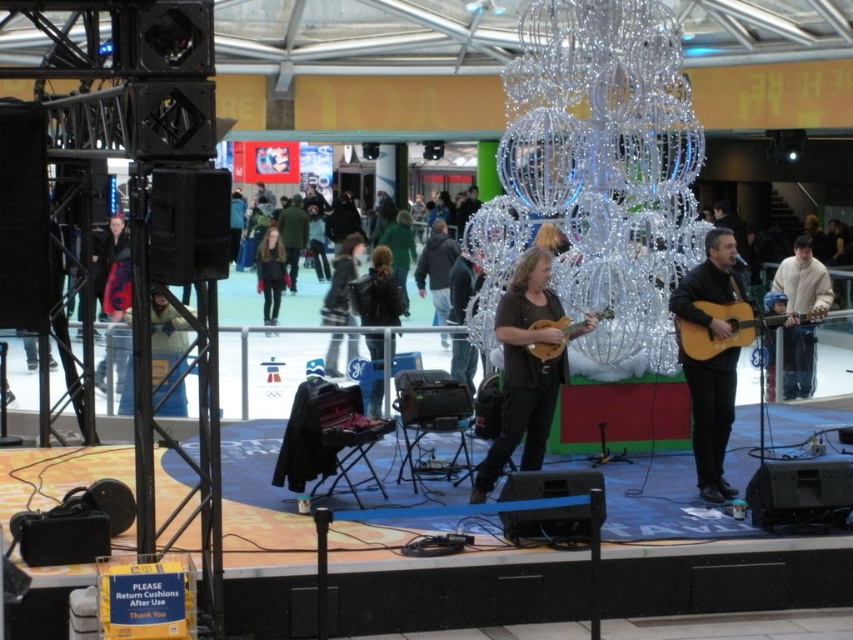
Consider the image. You are attending the event and want to take a photo of the performers. You notice the white woolen sweater at right and the black leather jacket at center. Which clothing item is shorter in height?

The white woolen sweater at right is shorter than the black leather jacket at center.

You are attending the event and want to know the color of the clothing worn by the person at point (804, 280). What is the color?

The person at point (804, 280) is wearing a white woolen sweater.

You are attending the event and want to place a small gift exactly at the center of the stage. The white woolen sweater at right is at coordinates point 0.438, 0.943. Can you determine if the sweater is closer to the center of the stage or the edge?

The white woolen sweater at right is located at point [804,280]. Since the center of the stage would be around point [426,320], the sweater is closer to the edge than the center.